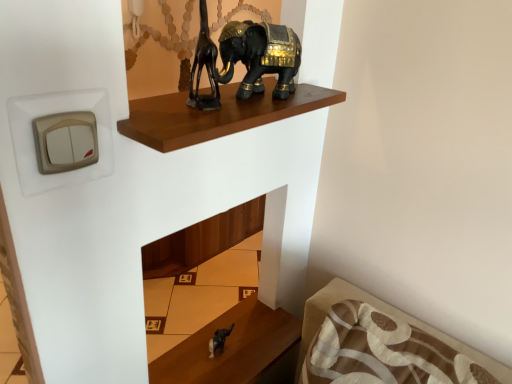
Find the location of `free space in front of black glossy elephant at upper center`. free space in front of black glossy elephant at upper center is located at coordinates (224, 115).